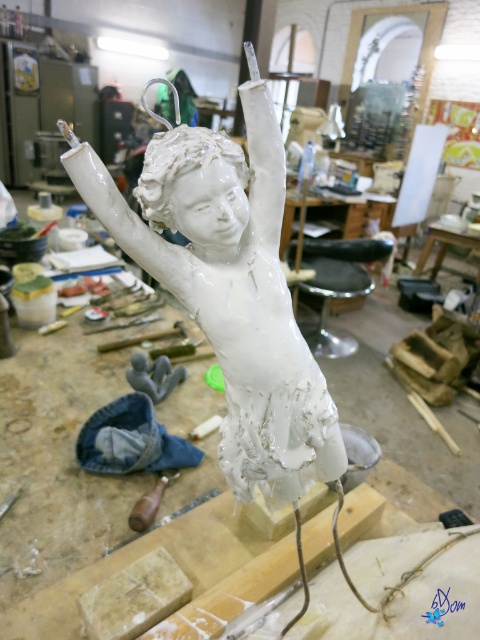
You are an art student who wants to place a small sticker on the white glossy statue at center without covering the wooden handle at center. Where should you place the sticker?

The white glossy statue at center is positioned over the wooden handle at center, so placing the sticker on the upper part of the statue would avoid covering the handle.

You are an artist who needs to determine if the white glossy statue at center can fit through a narrow doorway that is 1 meter wide. The wooden handle at center is 0.5 meters wide. Can the statue pass through the doorway?

The white glossy statue at center might be wider than the wooden handle at center, which is 0.5 meters wide. Since the doorway is 1 meter wide, the statue could potentially fit if its width is less than 1 meter. However, without exact measurements, it is uncertain whether it will pass through the doorway.